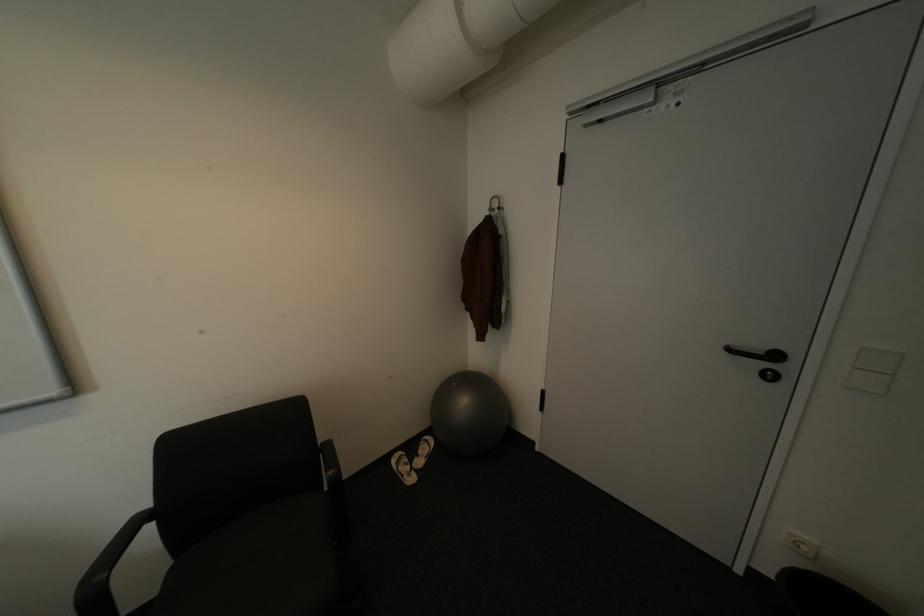
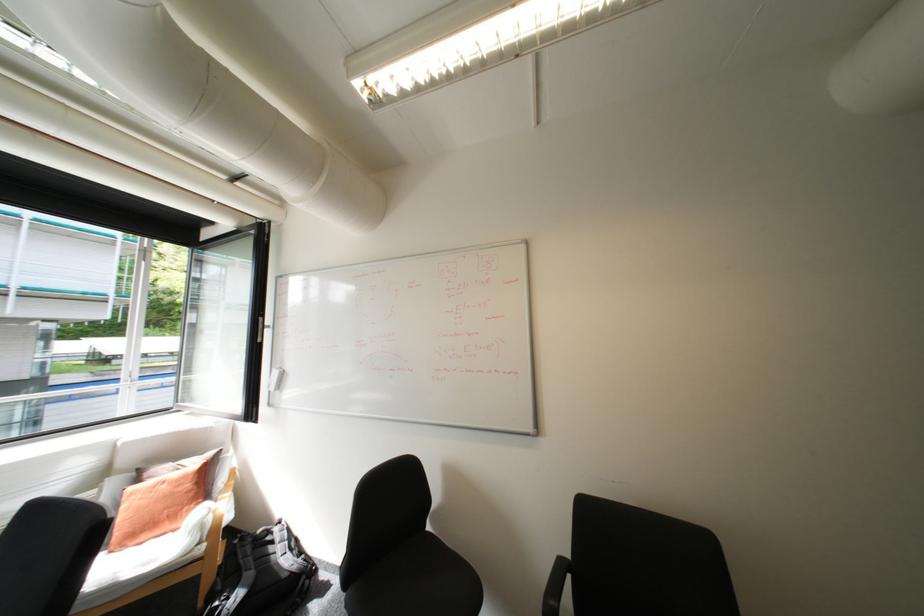
Question: The first image is from the beginning of the video and the second image is from the end. How did the camera likely rotate when shooting the video?

Choices:
 (A) Left
 (B) Right
 (C) Up
 (D) Down

Answer: (A)